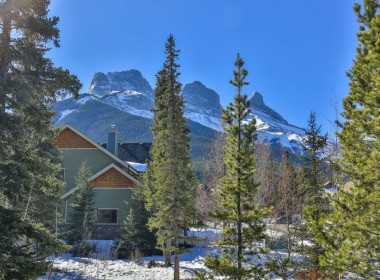
Where is `wood paneling`? This screenshot has height=280, width=380. wood paneling is located at coordinates (108, 200), (75, 159).